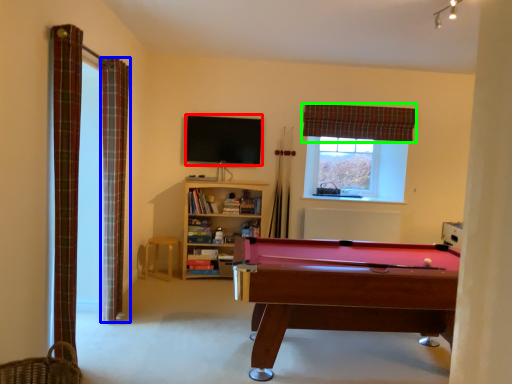
Question: Considering the real-world distances, which object is farthest from billard (highlighted by a red box)? curtain (highlighted by a blue box) or curtain (highlighted by a green box)?

Choices:
 (A) curtain
 (B) curtain

Answer: (A)